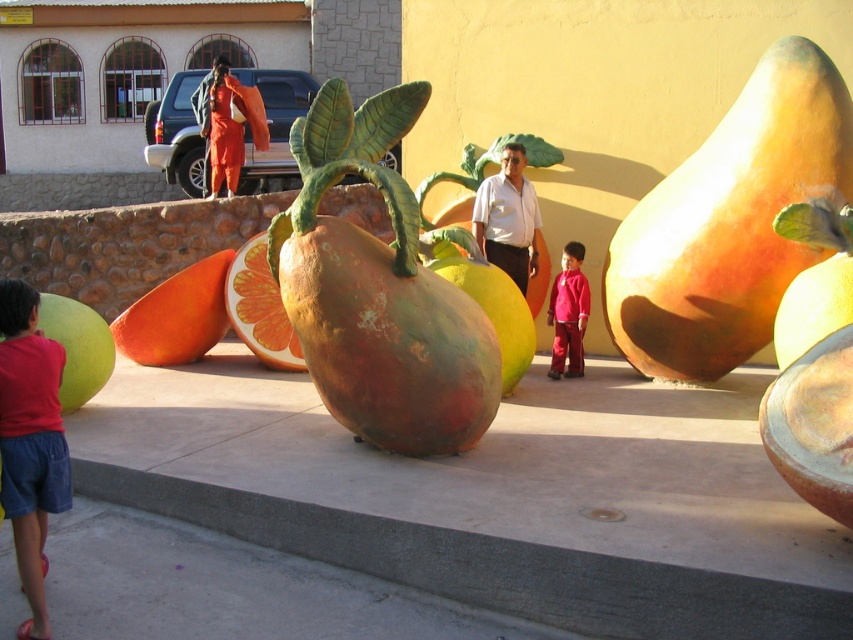
You are standing in front of the fruit sculptures and want to place a small statue between the matte orange squash at right and the rustic wood orange at center. Based on their positions, where should you place the statue to ensure it is between them?

The matte orange squash at right is above the rustic wood orange at center, so placing the statue between them would require positioning it below the matte orange squash at right and above the rustic wood orange at center.